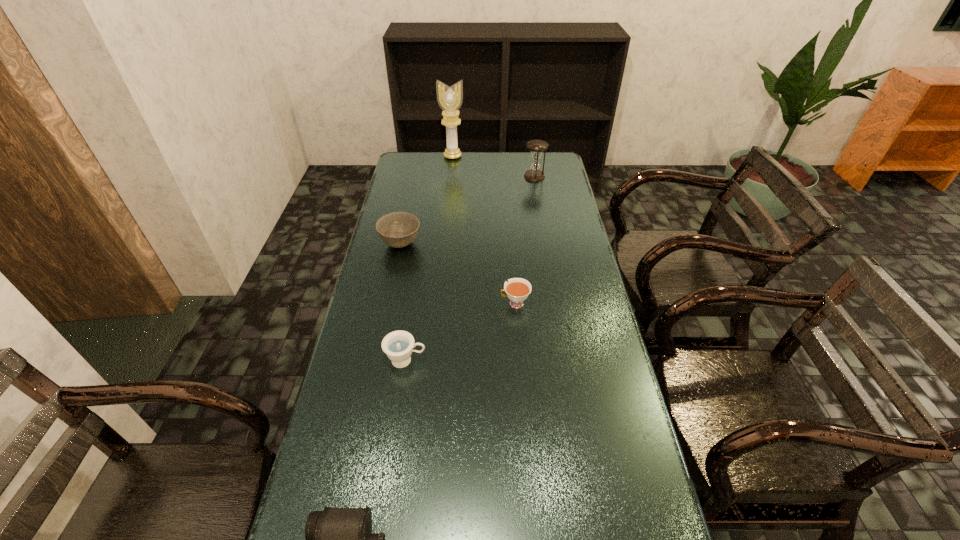
Where is `award`? This screenshot has width=960, height=540. award is located at coordinates (450, 99).

Identify the location of the tallest object. Image resolution: width=960 pixels, height=540 pixels. (450, 99).

You are a GUI agent. You are given a task and a screenshot of the screen. Output one action in this format:
    pyautogui.click(x=<x>, y=<y>)
    Task: Click on the fifth nearest object
    
    Given the screenshot: What is the action you would take?
    pyautogui.click(x=534, y=174)

Where is `hourglass`? The width and height of the screenshot is (960, 540). hourglass is located at coordinates [534, 174].

Identify the location of the third farthest object. The image size is (960, 540). tap(398, 229).

At what (x,y) coordinates should I click in order to perform the action: click on the left teacup. Please return your answer as a coordinate pair (x, y). Looking at the image, I should click on (398, 345).

Locate an element on the screen. The height and width of the screenshot is (540, 960). the nearer teacup is located at coordinates (398, 345).

The width and height of the screenshot is (960, 540). I want to click on the second object from right to left, so click(x=517, y=289).

This screenshot has width=960, height=540. In order to click on the fourth farthest object in this screenshot , I will do `click(517, 289)`.

Locate an element on the screen. vacant region located on the front-facing side of the farthest object is located at coordinates (449, 188).